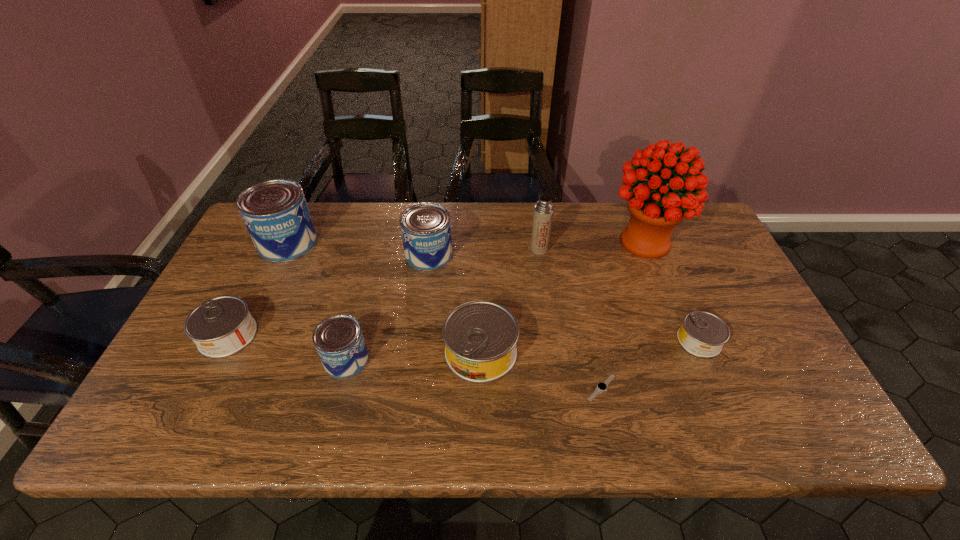
What are the coordinates of `the second smallest silver can` in the screenshot? It's located at (222, 326).

Identify the location of the shortest can. (x=702, y=334).

The width and height of the screenshot is (960, 540). Identify the location of the rightmost silver can. (702, 334).

The height and width of the screenshot is (540, 960). What are the coordinates of `the shortest object` in the screenshot? It's located at (602, 386).

Where is `watch`? The image size is (960, 540). watch is located at coordinates coord(602,386).

You are a GUI agent. You are given a task and a screenshot of the screen. Output one action in this format:
    pyautogui.click(x=<x>, y=<y>)
    Task: Click on the vacant space located on the front of the bouquet
    
    Given the screenshot: What is the action you would take?
    pyautogui.click(x=684, y=339)

Locate an element on the screen. vacant space positioned 0.300m on the front of the sixth object from left to right is located at coordinates (551, 334).

Identify the location of vacant space located on the front label of the biggest blue can. This screenshot has width=960, height=540. (252, 320).

Find the location of a particular element. The height and width of the screenshot is (540, 960). free location located on the front label of the rightmost blue can is located at coordinates (420, 325).

Locate an element on the screen. vacant space located on the front label of the fourth can from right to left is located at coordinates coord(464,360).